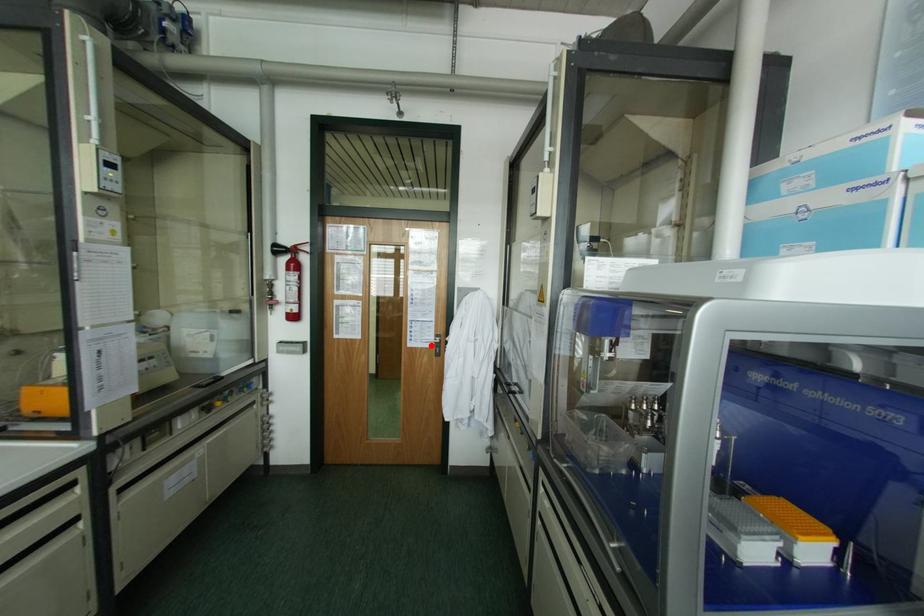
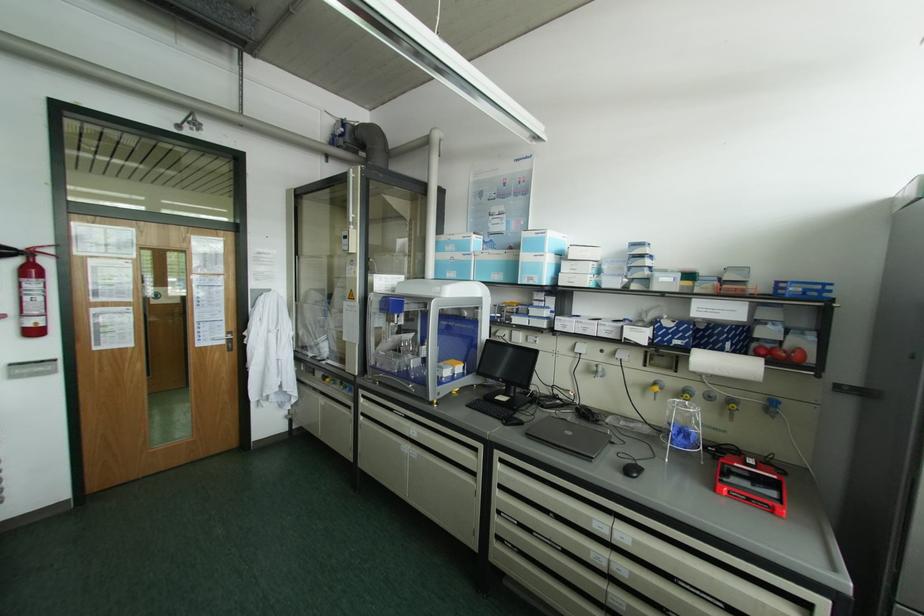
Where in the second image is the point corresponding to the highlighted location from the first image?

(224, 342)